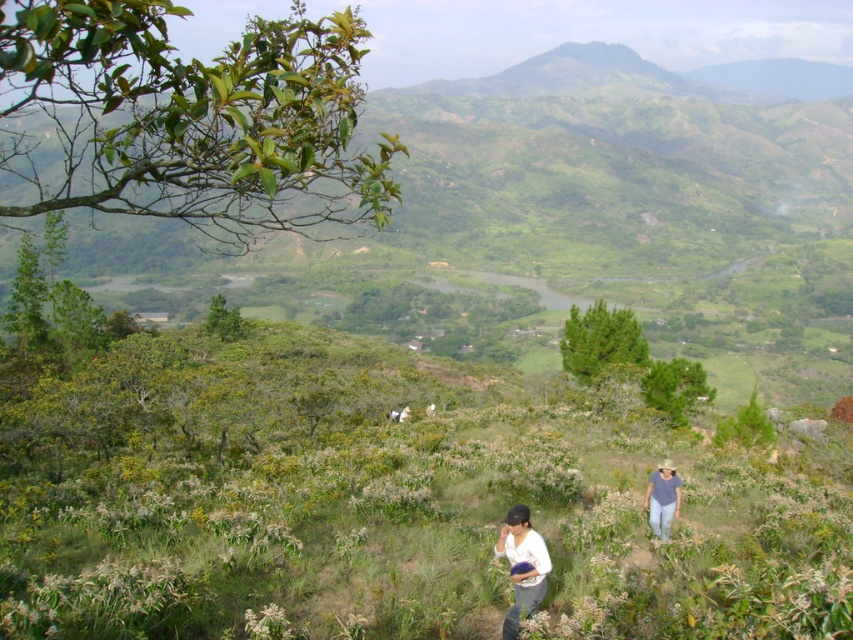
Does green leafy grass at center come in front of denim shirt at lower right?

Yes, it is in front of denim shirt at lower right.

At what (x,y) coordinates should I click in order to perform the action: click on green leafy grass at center. Please return your answer as a coordinate pair (x, y). The height and width of the screenshot is (640, 853). Looking at the image, I should click on (383, 502).

Locate an element on the screen. The height and width of the screenshot is (640, 853). green leafy grass at center is located at coordinates (383, 502).

Which is above, white matte shirt at lower center or denim shirt at lower right?

denim shirt at lower right is higher up.

Does point (503, 536) come in front of point (677, 499)?

Yes, it is.

Which is behind, point (495, 544) or point (677, 496)?

The point (677, 496) is more distant.

Where is `white matte shirt at lower center`? The width and height of the screenshot is (853, 640). white matte shirt at lower center is located at coordinates (521, 566).

Between green leafy grass at center and white matte shirt at lower center, which one has less height?

Standing shorter between the two is white matte shirt at lower center.

Between point (329, 449) and point (495, 552), which one is positioned behind?

The point (329, 449) is more distant.

Locate an element on the screen. The width and height of the screenshot is (853, 640). green leafy grass at center is located at coordinates (383, 502).